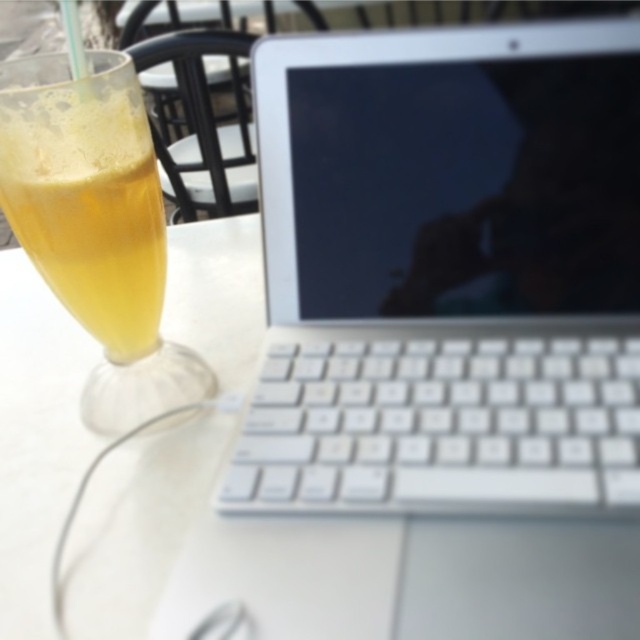
Question: Which object appears farthest from the camera in this image?

Choices:
 (A) translucent glass at left
 (B) white plastic table at center

Answer: (A)

Question: Which point is closer to the camera taking this photo?

Choices:
 (A) (378, 378)
 (B) (65, 150)
 (C) (92, 600)

Answer: (C)

Question: Can you confirm if white plastic laptop at center is bigger than white plastic table at center?

Choices:
 (A) no
 (B) yes

Answer: (A)

Question: Where is white plastic laptop at center located in relation to translucent glass at left in the image?

Choices:
 (A) above
 (B) below

Answer: (B)

Question: Based on their relative distances, which object is nearer to the white plastic table at center?

Choices:
 (A) translucent glass at left
 (B) white plastic laptop at center

Answer: (B)

Question: Is white plastic laptop at center thinner than translucent glass at left?

Choices:
 (A) no
 (B) yes

Answer: (A)